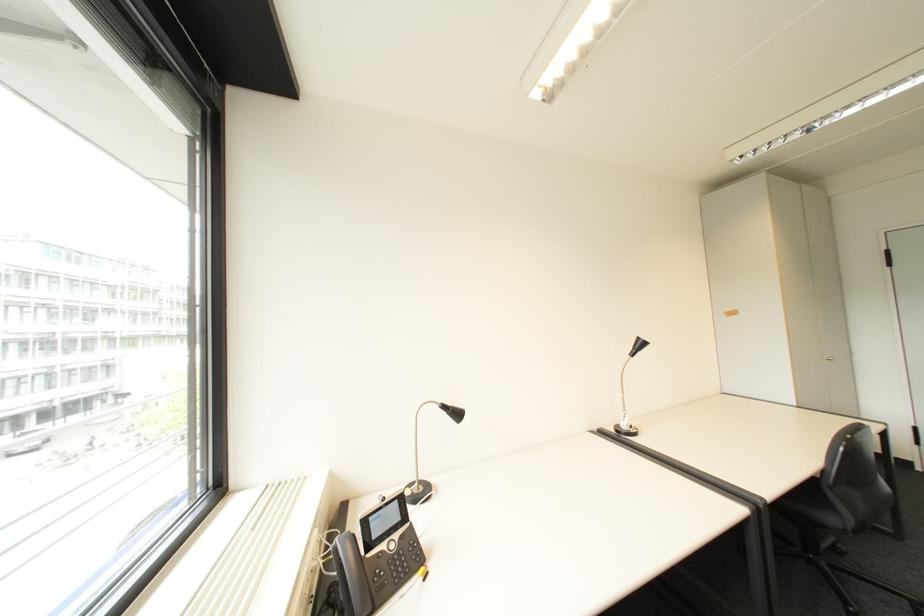
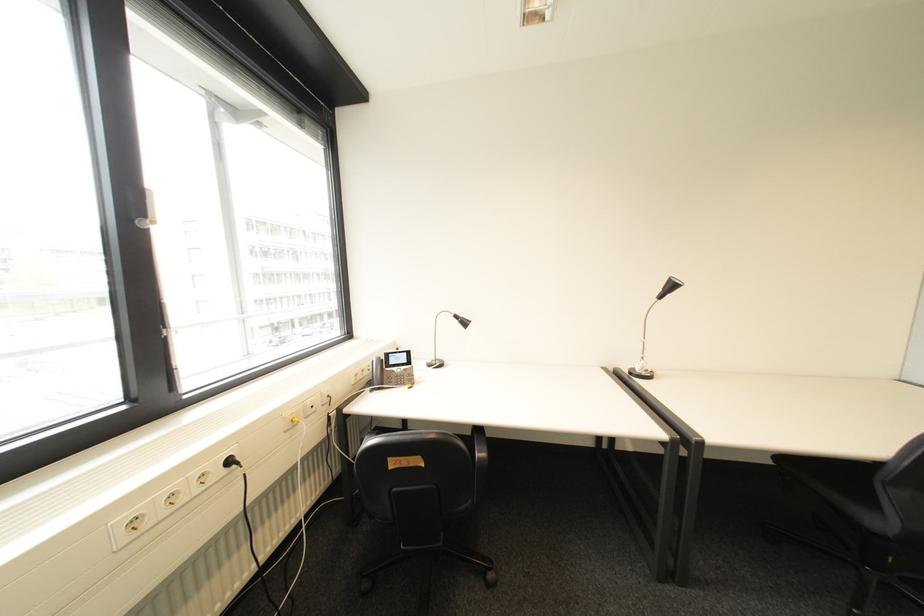
Where in the second image is the point corresponding to (x=643, y=347) from the first image?

(673, 290)